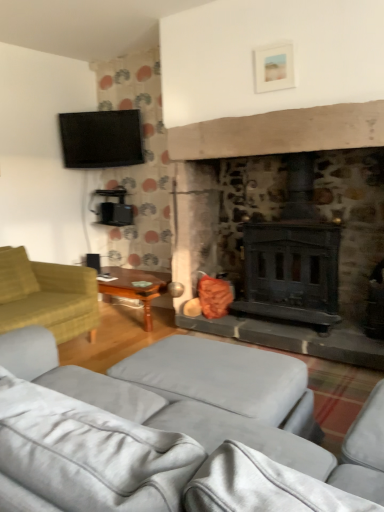
Looking at this image, what is the approximate height of soft yellow pillow at left?

soft yellow pillow at left is 21.67 inches in height.

Find the location of a particular element. matte white picture frame at upper center is located at coordinates (274, 67).

Based on the photo, in order to face matte black tv at upper left, should I rotate leftwards or rightwards?

A 11.690 degree turn to the left will do.

This screenshot has width=384, height=512. Describe the element at coordinates (101, 139) in the screenshot. I see `matte black tv at upper left` at that location.

What are the coordinates of `green fabric studio couch at left, placed as the second studio couch when sorted from front to back` in the screenshot? It's located at (46, 295).

In the scene shown: How different are the orientations of green fabric studio couch at left, placed as the second studio couch when sorted from front to back, and matte black tv at upper left in degrees?

The facing directions of green fabric studio couch at left, placed as the second studio couch when sorted from front to back, and matte black tv at upper left are 52 degrees apart.

From a real-world perspective, is green fabric studio couch at left, placed as the second studio couch when sorted from front to back, physically located above or below matte black tv at upper left?

green fabric studio couch at left, placed as the second studio couch when sorted from front to back, is below matte black tv at upper left.

Is green fabric studio couch at left, placed as the second studio couch when sorted from front to back, positioned far away from matte black tv at upper left?

green fabric studio couch at left, placed as the second studio couch when sorted from front to back, is far away from matte black tv at upper left.

Is the depth of green fabric studio couch at left, placed as the second studio couch when sorted from front to back, greater than that of matte black tv at upper left?

No, green fabric studio couch at left, placed as the second studio couch when sorted from front to back, is closer to the viewer.

From the soft yellow pillow at left, count 1st studio couch to the right and point to it. Please provide its 2D coordinates.

[(46, 295)]

Between green fabric studio couch at left, which is the 1th studio couch from back to front, and soft yellow pillow at left, which one has less height?

soft yellow pillow at left.

Is green fabric studio couch at left, which is the 1th studio couch from back to front, turned away from soft yellow pillow at left?

Yes, soft yellow pillow at left is at the back of green fabric studio couch at left, which is the 1th studio couch from back to front.

Does point (12, 285) come closer to viewer compared to point (4, 285)?

No.

How different are the orientations of matte black tv at upper left and matte white picture frame at upper center in degrees?

The angular difference between matte black tv at upper left and matte white picture frame at upper center is 39.5 degrees.

Is matte black tv at upper left oriented away from matte white picture frame at upper center?

No, matte black tv at upper left is not facing away from matte white picture frame at upper center.

From a real-world perspective, does matte black tv at upper left sit lower than matte white picture frame at upper center?

Yes, from a real-world perspective, matte black tv at upper left is below matte white picture frame at upper center.

Considering the positions of objects matte black tv at upper left and matte white picture frame at upper center in the image provided, who is more to the left, matte black tv at upper left or matte white picture frame at upper center?

matte black tv at upper left.

From the picture: Based on their sizes in the image, would you say light gray fabric studio couch at lower center, the first studio couch when ordered from front to back, is bigger or smaller than matte white picture frame at upper center?

Clearly, light gray fabric studio couch at lower center, the first studio couch when ordered from front to back, is larger in size than matte white picture frame at upper center.

How different are the orientations of light gray fabric studio couch at lower center, arranged as the 2th studio couch when viewed from the back, and matte white picture frame at upper center in degrees?

The angular difference between light gray fabric studio couch at lower center, arranged as the 2th studio couch when viewed from the back, and matte white picture frame at upper center is 180 degrees.

From the image's perspective, relative to matte white picture frame at upper center, is light gray fabric studio couch at lower center, the first studio couch when ordered from front to back, above or below?

light gray fabric studio couch at lower center, the first studio couch when ordered from front to back, is below matte white picture frame at upper center.

Locate an element on the screen. table on the left of light gray fabric studio couch at lower center, arranged as the 2th studio couch when viewed from the back is located at coordinates (136, 287).

Which point is more forward, (164, 286) or (104, 507)?

The point (104, 507) is in front.

Is wooden polished table at left positioned with its back to light gray fabric studio couch at lower center, the first studio couch when ordered from front to back?

wooden polished table at left is not turned away from light gray fabric studio couch at lower center, the first studio couch when ordered from front to back.

From the image's perspective, is matte black tv at upper left above green fabric studio couch at left, which is the 1th studio couch from back to front?

Yes.

From their relative heights in the image, would you say matte black tv at upper left is taller or shorter than green fabric studio couch at left, which is the 1th studio couch from back to front?

Clearly, matte black tv at upper left is shorter compared to green fabric studio couch at left, which is the 1th studio couch from back to front.

From a real-world perspective, between matte black tv at upper left and green fabric studio couch at left, which is the 1th studio couch from back to front, who is vertically higher?

In real-world perspective, matte black tv at upper left is above.

From the picture: Which is correct: matte black tv at upper left is inside green fabric studio couch at left, placed as the second studio couch when sorted from front to back, or outside of it?

The correct answer is: outside.

Who is bigger, soft yellow pillow at left or matte white picture frame at upper center?

With larger size is soft yellow pillow at left.

Considering the positions of objects soft yellow pillow at left and matte white picture frame at upper center in the image provided, who is more to the left, soft yellow pillow at left or matte white picture frame at upper center?

soft yellow pillow at left is more to the left.

Which object is closer to the camera, soft yellow pillow at left or matte white picture frame at upper center?

Positioned in front is matte white picture frame at upper center.

From the picture: From a real-world perspective, is soft yellow pillow at left positioned above or below matte white picture frame at upper center?

From a real-world perspective, soft yellow pillow at left is physically below matte white picture frame at upper center.

Identify the location of television that is on the right side of green fabric studio couch at left, which is the 1th studio couch from back to front. This screenshot has width=384, height=512. (101, 139).

The image size is (384, 512). In order to click on the 2nd studio couch positioned below the soft yellow pillow at left (from a real-world perspective) in this screenshot , I will do `click(46, 295)`.

Considering their positions, is soft yellow pillow at left positioned closer to light gray fabric studio couch at lower center, arranged as the 2th studio couch when viewed from the back, than matte black tv at upper left?

Based on the image, soft yellow pillow at left appears to be nearer to light gray fabric studio couch at lower center, arranged as the 2th studio couch when viewed from the back.

Based on their spatial positions, is wooden polished table at left or green fabric studio couch at left, which is the 1th studio couch from back to front, further from matte black tv at upper left?

green fabric studio couch at left, which is the 1th studio couch from back to front, is positioned further to the anchor matte black tv at upper left.

Which object lies nearer to the anchor point wooden polished table at left, matte white picture frame at upper center or light gray fabric studio couch at lower center, arranged as the 2th studio couch when viewed from the back?

The object closer to wooden polished table at left is light gray fabric studio couch at lower center, arranged as the 2th studio couch when viewed from the back.

Based on their spatial positions, is wooden polished table at left or soft yellow pillow at left closer to matte white picture frame at upper center?

wooden polished table at left.

From the image, which object appears to be nearer to matte black tv at upper left, soft yellow pillow at left or matte white picture frame at upper center?

soft yellow pillow at left.

Looking at this image, based on their spatial positions, is matte black tv at upper left or matte white picture frame at upper center further from soft yellow pillow at left?

matte white picture frame at upper center lies further to soft yellow pillow at left than the other object.

In the scene shown: Which object lies nearer to the anchor point soft yellow pillow at left, green fabric studio couch at left, which is the 1th studio couch from back to front, or matte white picture frame at upper center?

green fabric studio couch at left, which is the 1th studio couch from back to front, is closer to soft yellow pillow at left.

Looking at the image, which one is located closer to matte white picture frame at upper center, light gray fabric studio couch at lower center, arranged as the 2th studio couch when viewed from the back, or green fabric studio couch at left, placed as the second studio couch when sorted from front to back?

light gray fabric studio couch at lower center, arranged as the 2th studio couch when viewed from the back, is closer to matte white picture frame at upper center.

What are the coordinates of `table located between light gray fabric studio couch at lower center, arranged as the 2th studio couch when viewed from the back, and matte black tv at upper left in the depth direction` in the screenshot? It's located at [136, 287].

Image resolution: width=384 pixels, height=512 pixels. What are the coordinates of `picture frame between light gray fabric studio couch at lower center, the first studio couch when ordered from front to back, and wooden polished table at left from front to back` in the screenshot? It's located at (274, 67).

Locate an element on the screen. pillow between light gray fabric studio couch at lower center, the first studio couch when ordered from front to back, and matte black tv at upper left, along the z-axis is located at coordinates (16, 275).

I want to click on television situated between green fabric studio couch at left, which is the 1th studio couch from back to front, and matte white picture frame at upper center from left to right, so click(101, 139).